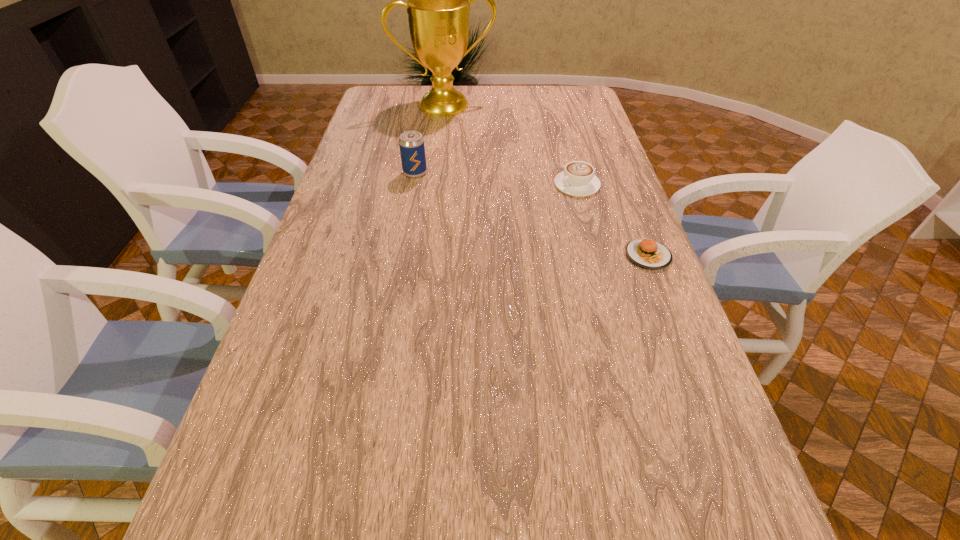
Where is `vacant region located 0.050m on the shiny surface of the farthest object`? The image size is (960, 540). vacant region located 0.050m on the shiny surface of the farthest object is located at coordinates (464, 123).

Locate an element on the screen. vacant space positioned on the shiny surface of the farthest object is located at coordinates (483, 154).

Where is `vacant region located with the handle on the right side of the third tallest object`? This screenshot has height=540, width=960. vacant region located with the handle on the right side of the third tallest object is located at coordinates (524, 213).

Identify the location of free region located 0.200m with the handle on the right side of the third tallest object. (515, 219).

At what (x,y) coordinates should I click in order to perform the action: click on vacant region located 0.220m with the handle on the right side of the third tallest object. Please return your answer as a coordinate pair (x, y). The width and height of the screenshot is (960, 540). Looking at the image, I should click on (509, 222).

At what (x,y) coordinates should I click in order to perform the action: click on object at the far edge. Please return your answer as a coordinate pair (x, y). The width and height of the screenshot is (960, 540). Looking at the image, I should click on (438, 5).

Identify the location of object that is at the left edge. (438, 5).

This screenshot has height=540, width=960. I want to click on food that is positioned at the right edge, so (646, 253).

Locate an element on the screen. cappuccino present at the right edge is located at coordinates (578, 179).

Find the location of `object situated at the far left corner`. object situated at the far left corner is located at coordinates (438, 5).